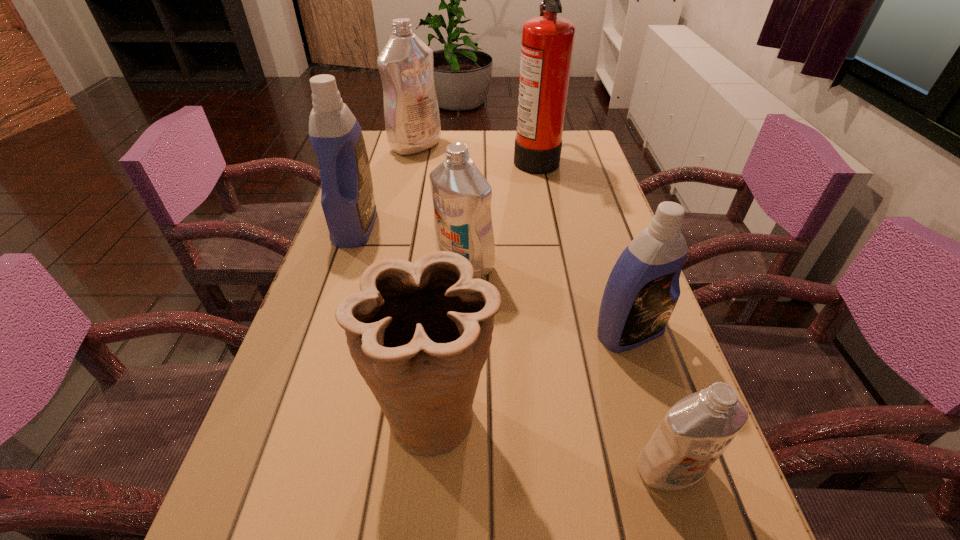
Where is `urn`? The width and height of the screenshot is (960, 540). urn is located at coordinates (419, 333).

Identify the location of the smallest white detergent. Image resolution: width=960 pixels, height=540 pixels. (697, 429).

The image size is (960, 540). What are the coordinates of `the nearest white detergent` in the screenshot? It's located at (697, 429).

Identify the location of vacant point located on the front-facing side of the tallest object. (463, 157).

Identify the location of free spot located on the front-facing side of the tallest object. (454, 157).

Find the location of a particular element. vacant space situated 0.170m on the front-facing side of the tallest object is located at coordinates (460, 157).

The height and width of the screenshot is (540, 960). Identify the location of vacant space located 0.270m on the right of the farthest white detergent. (522, 146).

Identify the location of vacant area situated 0.160m on the right of the left blue detergent. This screenshot has height=540, width=960. (438, 227).

You are a GUI agent. You are given a task and a screenshot of the screen. Output one action in this format:
    pyautogui.click(x=<x>, y=<y>)
    Task: Click on the free location located 0.260m on the left of the third detergent from right to left
    Image resolution: width=960 pixels, height=540 pixels.
    Given the screenshot: What is the action you would take?
    pyautogui.click(x=324, y=264)

Find the location of a particular element. The height and width of the screenshot is (540, 960). blank area located 0.060m on the left of the second nearest detergent is located at coordinates (562, 333).